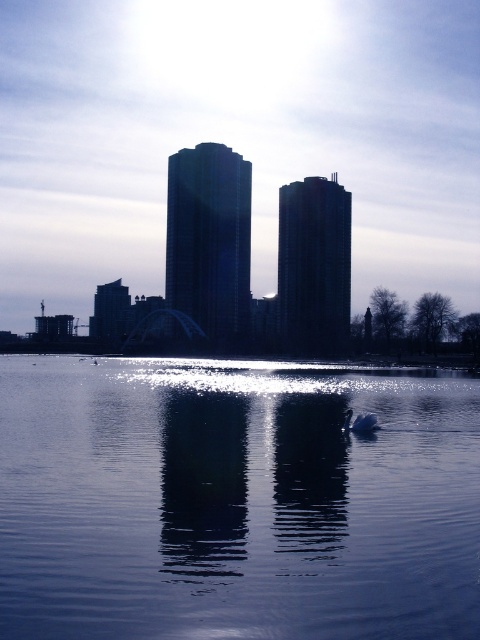
Can you confirm if clear water at center is positioned to the left of white glossy swan at lower center?

Yes, clear water at center is to the left of white glossy swan at lower center.

Between clear water at center and white glossy swan at lower center, which one is positioned lower?

Positioned lower is clear water at center.

Is point (322, 522) farther from camera compared to point (375, 419)?

No, it is not.

The image size is (480, 640). I want to click on clear water at center, so click(x=236, y=500).